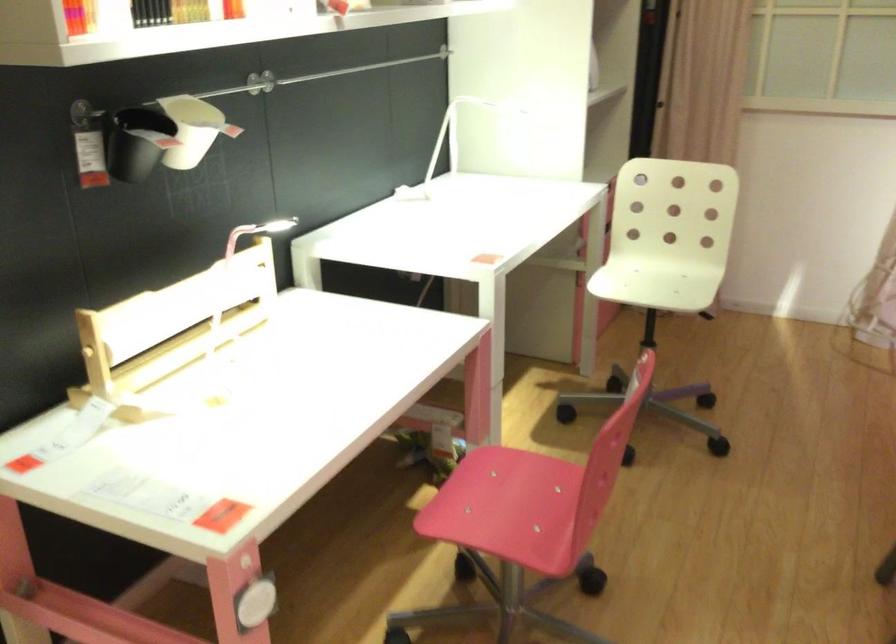
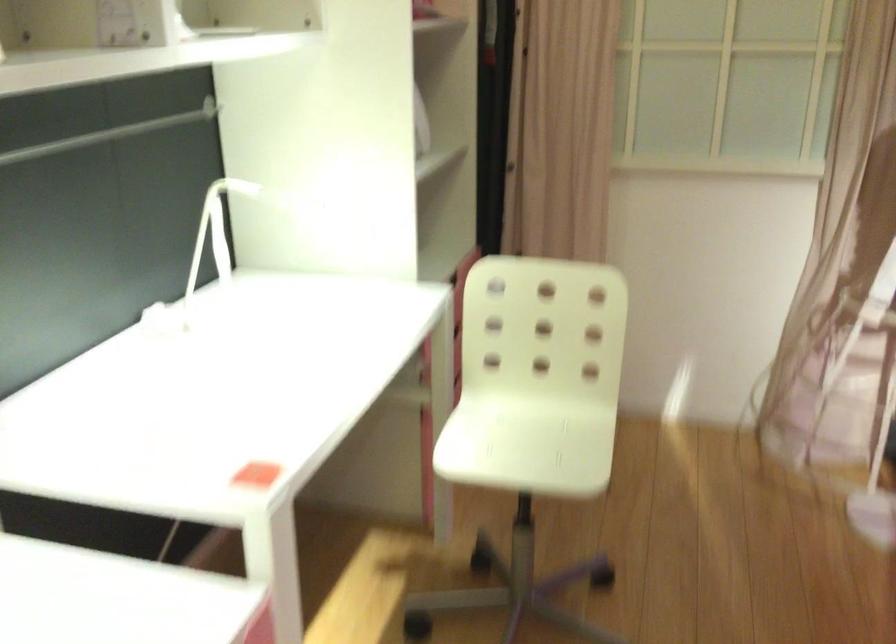
Locate, in the second image, the point that corresponds to (x=446, y=133) in the first image.

(213, 234)